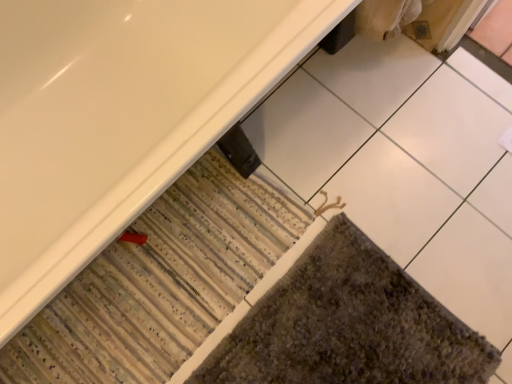
Question: Should I look upward or downward to see white glossy bathtub at lower left?

Choices:
 (A) down
 (B) up

Answer: (B)

Question: Could you tell me if striped carpet at lower left, the second bath mat from the right, is turned towards textured gray bath mat at lower right, marked as the 1th bath mat in a right-to-left arrangement?

Choices:
 (A) yes
 (B) no

Answer: (A)

Question: Considering the relative sizes of striped carpet at lower left, which appears as the 1th bath mat when viewed from the left, and textured gray bath mat at lower right, marked as the 1th bath mat in a right-to-left arrangement, in the image provided, is striped carpet at lower left, which appears as the 1th bath mat when viewed from the left, bigger than textured gray bath mat at lower right, marked as the 1th bath mat in a right-to-left arrangement,?

Choices:
 (A) yes
 (B) no

Answer: (A)

Question: Is striped carpet at lower left, which appears as the 1th bath mat when viewed from the left, turned away from textured gray bath mat at lower right, marked as the 1th bath mat in a right-to-left arrangement?

Choices:
 (A) no
 (B) yes

Answer: (A)

Question: From a real-world perspective, is striped carpet at lower left, the second bath mat from the right, positioned under textured gray bath mat at lower right, arranged as the 2th bath mat when viewed from the left, based on gravity?

Choices:
 (A) yes
 (B) no

Answer: (A)

Question: From the image's perspective, is striped carpet at lower left, the second bath mat from the right, located beneath textured gray bath mat at lower right, arranged as the 2th bath mat when viewed from the left?

Choices:
 (A) yes
 (B) no

Answer: (B)

Question: Is striped carpet at lower left, the second bath mat from the right, shorter than textured gray bath mat at lower right, marked as the 1th bath mat in a right-to-left arrangement?

Choices:
 (A) yes
 (B) no

Answer: (B)

Question: Can you confirm if striped carpet at lower left, the second bath mat from the right, is bigger than white glossy bathtub at lower left?

Choices:
 (A) yes
 (B) no

Answer: (B)

Question: Is striped carpet at lower left, which appears as the 1th bath mat when viewed from the left, at the right side of white glossy bathtub at lower left?

Choices:
 (A) no
 (B) yes

Answer: (B)

Question: Is striped carpet at lower left, the second bath mat from the right, directly adjacent to white glossy bathtub at lower left?

Choices:
 (A) no
 (B) yes

Answer: (A)

Question: From the image's perspective, would you say striped carpet at lower left, which appears as the 1th bath mat when viewed from the left, is positioned over white glossy bathtub at lower left?

Choices:
 (A) yes
 (B) no

Answer: (B)

Question: Is striped carpet at lower left, which appears as the 1th bath mat when viewed from the left, smaller than white glossy bathtub at lower left?

Choices:
 (A) yes
 (B) no

Answer: (A)

Question: Is striped carpet at lower left, which appears as the 1th bath mat when viewed from the left, to the left of white glossy bathtub at lower left from the viewer's perspective?

Choices:
 (A) no
 (B) yes

Answer: (A)

Question: Considering the relative sizes of textured gray bath mat at lower right, arranged as the 2th bath mat when viewed from the left, and white glossy bathtub at lower left in the image provided, is textured gray bath mat at lower right, arranged as the 2th bath mat when viewed from the left, bigger than white glossy bathtub at lower left?

Choices:
 (A) no
 (B) yes

Answer: (A)